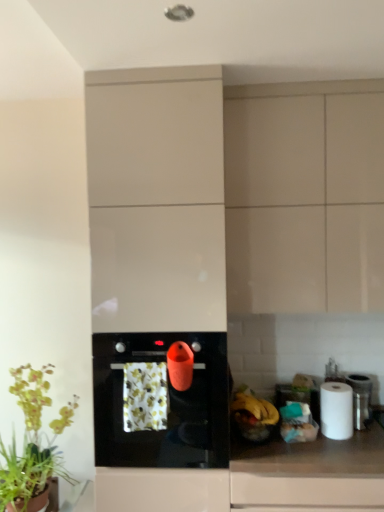
This screenshot has width=384, height=512. In order to click on free space in front of metallic silver canister at right in this screenshot , I will do `click(367, 437)`.